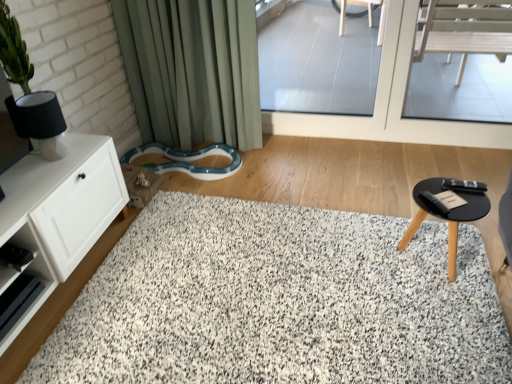
At what (x,y) coordinates should I click in order to perform the action: click on black matte table at lower right. Please return your answer as a coordinate pair (x, y). The width and height of the screenshot is (512, 384). Looking at the image, I should click on (448, 209).

In order to face green fabric curtain at upper left, should I rotate leftwards or rightwards?

You should rotate left by 8.648 degrees.

At what (x,y) coordinates should I click in order to perform the action: click on white shaggy rug at center. Please return your answer as a coordinate pair (x, y). Looking at the image, I should click on (279, 302).

From the image's perspective, is transparent glass door at upper center, the 2th window screen from the right, above or below green fabric curtain at upper left?

transparent glass door at upper center, the 2th window screen from the right, is above green fabric curtain at upper left.

Does transparent glass door at upper center, which appears as the 1th window screen when viewed from the left, have a larger size compared to green fabric curtain at upper left?

No.

Is transparent glass door at upper center, which appears as the 1th window screen when viewed from the left, not near green fabric curtain at upper left?

Yes, transparent glass door at upper center, which appears as the 1th window screen when viewed from the left, is far from green fabric curtain at upper left.

Is transparent glass door at upper center, the 2th window screen from the right, positioned before green fabric curtain at upper left?

No, transparent glass door at upper center, the 2th window screen from the right, is further to the viewer.

Is black matte table at lower right shorter than white shaggy rug at center?

In fact, black matte table at lower right may be taller than white shaggy rug at center.

From a real-world perspective, which object rests below the other?

In real-world perspective, white shaggy rug at center is lower.

Consider the image. Between black matte table at lower right and white shaggy rug at center, which one has larger width?

white shaggy rug at center.

Considering the sizes of objects black matte table at lower right and white shaggy rug at center in the image provided, who is smaller, black matte table at lower right or white shaggy rug at center?

With smaller size is black matte table at lower right.

Is green fabric curtain at upper left facing away from transparent glass window at center, arranged as the 2th window screen when viewed from the left?

green fabric curtain at upper left does not have its back to transparent glass window at center, arranged as the 2th window screen when viewed from the left.

From a real-world perspective, count 2nd window screens downward from the green fabric curtain at upper left and point to it. Please provide its 2D coordinates.

[(391, 103)]

Which is in front, point (223, 111) or point (393, 102)?

The point (393, 102) is closer to the camera.

From the image's perspective, is green fabric curtain at upper left located above transparent glass window at center, arranged as the 2th window screen when viewed from the left?

No, from the image's perspective, green fabric curtain at upper left is not above transparent glass window at center, arranged as the 2th window screen when viewed from the left.

From a real-world perspective, is white shaggy rug at center positioned above or below transparent glass window at center, arranged as the 2th window screen when viewed from the left?

Clearly, from a real-world perspective, white shaggy rug at center is below transparent glass window at center, arranged as the 2th window screen when viewed from the left.

Could you tell me if white shaggy rug at center is turned towards transparent glass window at center, which appears as the first window screen when viewed from the right?

No, white shaggy rug at center is not facing towards transparent glass window at center, which appears as the first window screen when viewed from the right.

From the image's perspective, relative to transparent glass window at center, which appears as the first window screen when viewed from the right, is white shaggy rug at center above or below?

Clearly, from the image's perspective, white shaggy rug at center is below transparent glass window at center, which appears as the first window screen when viewed from the right.

From a real-world perspective, between white shaggy rug at center and green fabric curtain at upper left, who is vertically higher?

green fabric curtain at upper left is physically above.

Looking at this image, are white shaggy rug at center and green fabric curtain at upper left making contact?

white shaggy rug at center and green fabric curtain at upper left are not in contact.

Considering the sizes of objects white shaggy rug at center and green fabric curtain at upper left in the image provided, who is taller, white shaggy rug at center or green fabric curtain at upper left?

green fabric curtain at upper left.

Considering the positions of points (445, 216) and (69, 222), is point (445, 216) closer to camera compared to point (69, 222)?

Yes, it is.

Where is `cabinetry lying below the black matte table at lower right (from the image's perspective)`? This screenshot has height=384, width=512. cabinetry lying below the black matte table at lower right (from the image's perspective) is located at coordinates (60, 210).

In the image, is black matte table at lower right positioned in front of or behind white matte cabinet at left?

black matte table at lower right is behind white matte cabinet at left.

Considering the relative sizes of black matte table at lower right and white matte cabinet at left in the image provided, is black matte table at lower right bigger than white matte cabinet at left?

Incorrect, black matte table at lower right is not larger than white matte cabinet at left.

Where is `window screen in front of the green fabric curtain at upper left`? window screen in front of the green fabric curtain at upper left is located at coordinates (391, 103).

Could you tell me if transparent glass window at center, which appears as the first window screen when viewed from the right, is facing green fabric curtain at upper left?

No, transparent glass window at center, which appears as the first window screen when viewed from the right, does not turn towards green fabric curtain at upper left.

Considering the relative sizes of transparent glass window at center, arranged as the 2th window screen when viewed from the left, and green fabric curtain at upper left in the image provided, is transparent glass window at center, arranged as the 2th window screen when viewed from the left, shorter than green fabric curtain at upper left?

Yes.

Is transparent glass window at center, arranged as the 2th window screen when viewed from the left, to the left of green fabric curtain at upper left from the viewer's perspective?

Incorrect, transparent glass window at center, arranged as the 2th window screen when viewed from the left, is not on the left side of green fabric curtain at upper left.

Where is `window screen that is the 1st one below the green fabric curtain at upper left (from a real-world perspective)`? The height and width of the screenshot is (384, 512). window screen that is the 1st one below the green fabric curtain at upper left (from a real-world perspective) is located at coordinates (319, 60).

Find the location of a particular element. Image resolution: width=512 pixels, height=384 pixels. mat on the left of black matte table at lower right is located at coordinates click(x=279, y=302).

Based on their spatial positions, is black matte lampshade at upper left or transparent glass door at upper center, the 2th window screen from the right, further from black matte table at lower right?

Among the two, transparent glass door at upper center, the 2th window screen from the right, is located further to black matte table at lower right.

Based on their spatial positions, is transparent glass window at center, which appears as the first window screen when viewed from the right, or white matte cabinet at left closer to green fabric curtain at upper left?

transparent glass window at center, which appears as the first window screen when viewed from the right, is closer to green fabric curtain at upper left.

Estimate the real-world distances between objects in this image. Which object is further from transparent glass window at center, arranged as the 2th window screen when viewed from the left, white matte cabinet at left or black matte table at lower right?

white matte cabinet at left is further to transparent glass window at center, arranged as the 2th window screen when viewed from the left.

Looking at the image, which one is located further to transparent glass door at upper center, the 2th window screen from the right, green fabric curtain at upper left or black matte lampshade at upper left?

Based on the image, black matte lampshade at upper left appears to be further to transparent glass door at upper center, the 2th window screen from the right.

From the image, which object appears to be farther from black matte table at lower right, transparent glass door at upper center, the 2th window screen from the right, or white shaggy rug at center?

Among the two, transparent glass door at upper center, the 2th window screen from the right, is located further to black matte table at lower right.

Estimate the real-world distances between objects in this image. Which object is closer to black matte table at lower right, white shaggy rug at center or white matte cabinet at left?

white shaggy rug at center is closer to black matte table at lower right.

Based on their spatial positions, is black matte lampshade at upper left or green fabric curtain at upper left closer to white matte cabinet at left?

Based on the image, black matte lampshade at upper left appears to be nearer to white matte cabinet at left.

When comparing their distances from black matte lampshade at upper left, does transparent glass window at center, which appears as the first window screen when viewed from the right, or transparent glass door at upper center, the 2th window screen from the right, seem further?

transparent glass door at upper center, the 2th window screen from the right.

Where is `mat situated between white matte cabinet at left and transparent glass window at center, which appears as the first window screen when viewed from the right, from left to right`? mat situated between white matte cabinet at left and transparent glass window at center, which appears as the first window screen when viewed from the right, from left to right is located at coordinates (279, 302).

You are a GUI agent. You are given a task and a screenshot of the screen. Output one action in this format:
    pyautogui.click(x=<x>, y=<y>)
    Task: Click on the mat situated between black matte lampshade at upper left and transparent glass window at center, which appears as the first window screen when viewed from the right, from left to right
    Image resolution: width=512 pixels, height=384 pixels.
    Given the screenshot: What is the action you would take?
    pyautogui.click(x=279, y=302)

Locate an element on the screen. mat between white matte cabinet at left and transparent glass door at upper center, which appears as the 1th window screen when viewed from the left, in the horizontal direction is located at coordinates (279, 302).

The width and height of the screenshot is (512, 384). In order to click on cabinetry between green fabric curtain at upper left and white shaggy rug at center in the vertical direction in this screenshot , I will do `click(60, 210)`.